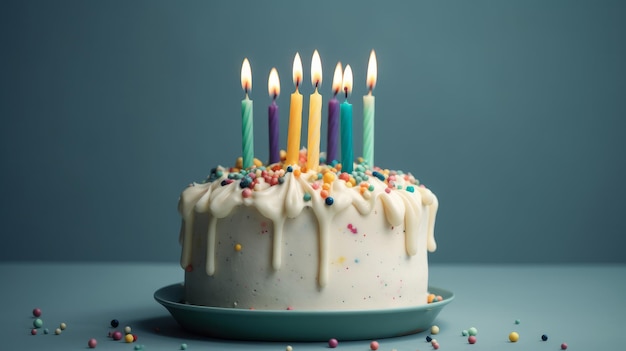
You are a GUI agent. You are given a task and a screenshot of the screen. Output one action in this format:
    pyautogui.click(x=<x>, y=<y>)
    Task: Click on the birthday candles
    
    Given the screenshot: What is the action you would take?
    pyautogui.click(x=250, y=120), pyautogui.click(x=270, y=118), pyautogui.click(x=297, y=134), pyautogui.click(x=312, y=130), pyautogui.click(x=332, y=122), pyautogui.click(x=347, y=136), pyautogui.click(x=369, y=136)